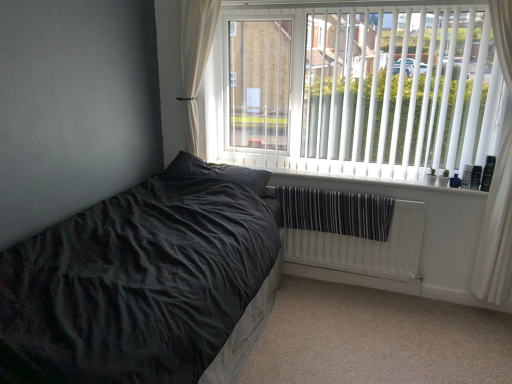
The width and height of the screenshot is (512, 384). I want to click on free point above white textured radiator at lower right (from a real-world perspective), so pyautogui.click(x=352, y=193).